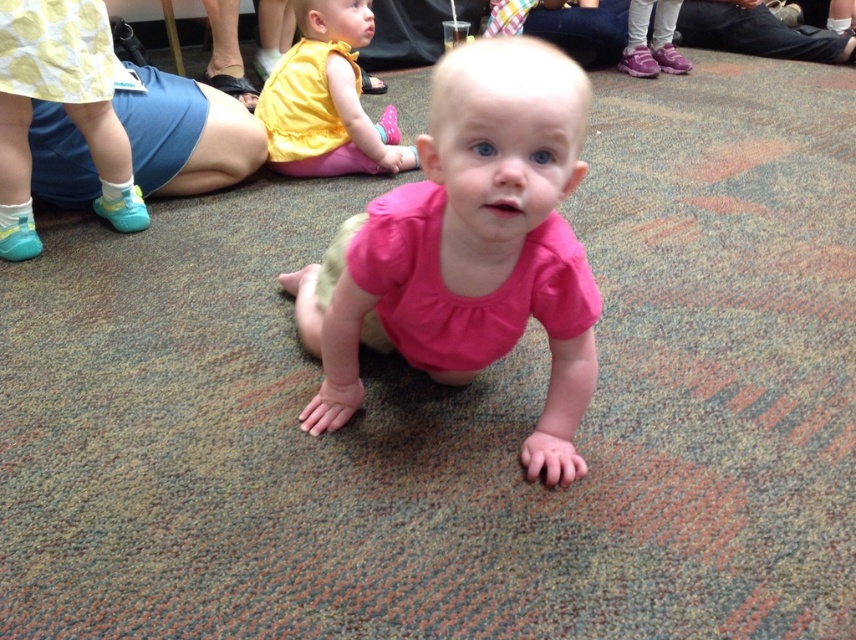
Question: Is pink fabric toddler at center to the left of yellow matte dress at upper center from the viewer's perspective?

Choices:
 (A) no
 (B) yes

Answer: (A)

Question: Among these objects, which one is farthest from the camera?

Choices:
 (A) yellow matte dress at upper center
 (B) pink fabric toddler at center

Answer: (A)

Question: Can you confirm if pink fabric toddler at center is positioned to the left of yellow matte dress at upper center?

Choices:
 (A) yes
 (B) no

Answer: (B)

Question: Can you confirm if pink fabric toddler at center is thinner than yellow matte dress at upper center?

Choices:
 (A) yes
 (B) no

Answer: (B)

Question: Which point appears closest to the camera in this image?

Choices:
 (A) (366, 257)
 (B) (304, 51)

Answer: (A)